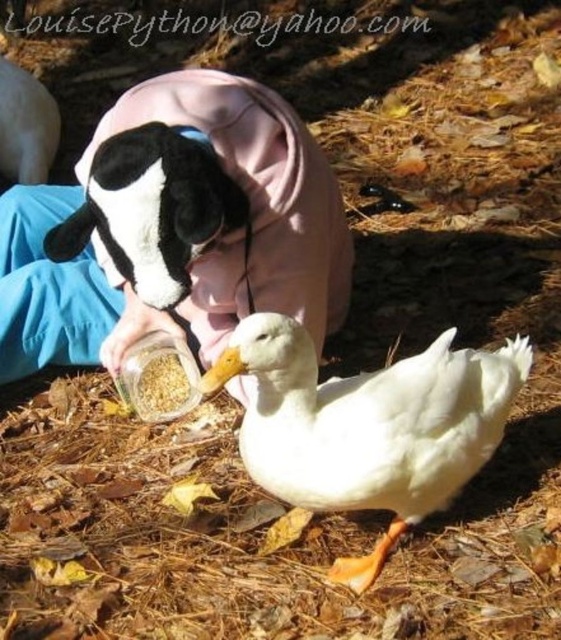
You are a child who wants to carry both the white matte duck at center and the soft plush toy at center in one hand. Can you hold both items comfortably?

The white matte duck at center is bigger than the soft plush toy at center, so it might be challenging to hold both comfortably in one hand due to their combined size.

You are a delivery robot with a 36 inch wide package. You need to move from the pink fleece jacket at center to the black plush toy at upper left. Can you fit through the space between them?

The pink fleece jacket at center is 37.28 inches away from the black plush toy at upper left. Since the package is 36 inches wide, it can fit through the space between them as there is enough clearance.

You are trying to decide whether to place the pink fleece jacket at center and the soft plush toy at center on a narrow shelf. Based on their sizes, which one will fit better?

The soft plush toy at center will fit better on the narrow shelf because the pink fleece jacket at center is wider than the soft plush toy at center.